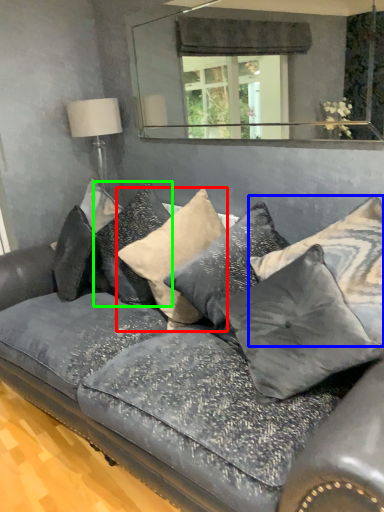
Question: Which object is the closest to the pillow (highlighted by a red box)? Choose among these: pillow (highlighted by a blue box) or pillow (highlighted by a green box).

Choices:
 (A) pillow
 (B) pillow

Answer: (B)